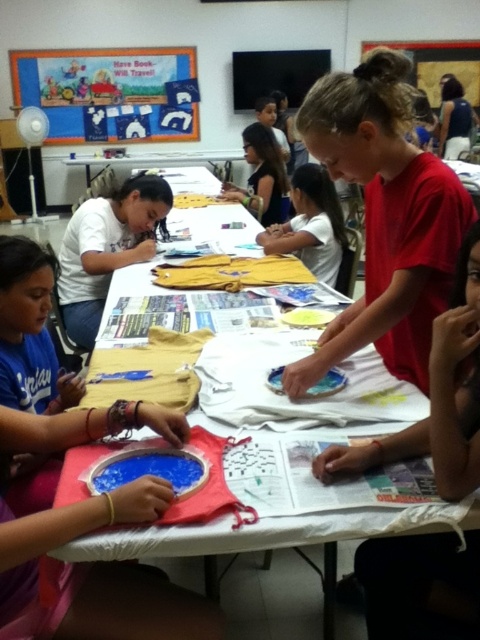
What are the coordinates of the red matte shirt at center?

The red matte shirt at center is located at point (384, 218).

In the classroom scene, there are a red matte shirt at center and a matte yellow shirt at upper center on the tables. Which shirt takes up more space on the table?

The matte yellow shirt at upper center takes up more space on the table than the red matte shirt at center because the red matte shirt at center occupies less space.